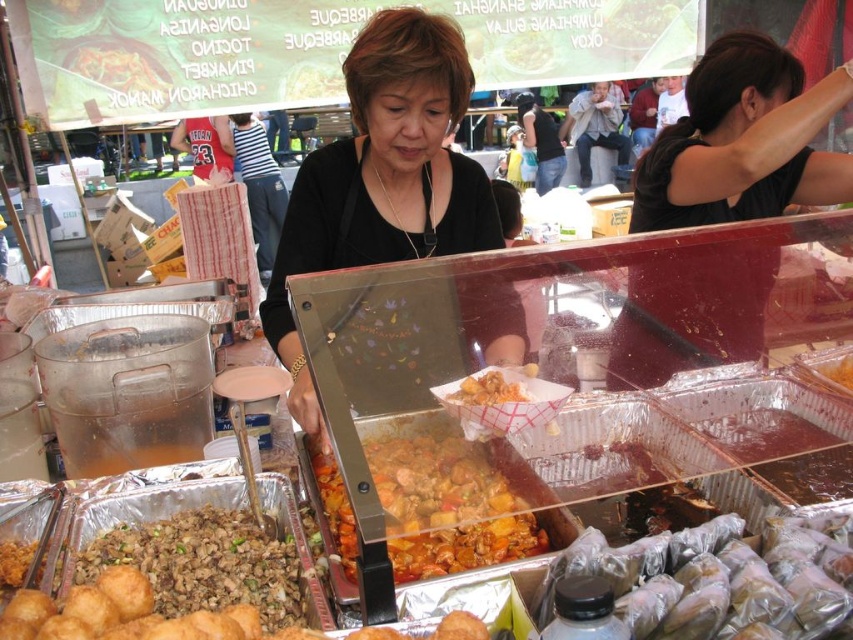
Question: Can you confirm if golden brown stew at center is wider than brown crumbly meat at lower left?

Choices:
 (A) yes
 (B) no

Answer: (A)

Question: Which of these objects is positioned closest to the brown crumbly meat at lower left?

Choices:
 (A) golden crispy chicken at center
 (B) translucent plastic container at center
 (C) golden crispy pastry at center

Answer: (C)

Question: Considering the real-world distances, which object is farthest from the white creamy soup at center?

Choices:
 (A) black matte shirt at center
 (B) shiny silver foil at lower right
 (C) black matte shirt at upper right
 (D) brown crumbly meat at lower left

Answer: (B)

Question: Is black matte shirt at center thinner than golden brown stew at center?

Choices:
 (A) no
 (B) yes

Answer: (A)

Question: Estimate the real-world distances between objects in this image. Which object is closer to the black matte shirt at upper right?

Choices:
 (A) golden crispy chicken at center
 (B) white creamy soup at center
 (C) brown crumbly meat at lower left

Answer: (A)

Question: Does golden brown stew at center appear on the left side of golden fried balls at lower left?

Choices:
 (A) no
 (B) yes

Answer: (A)